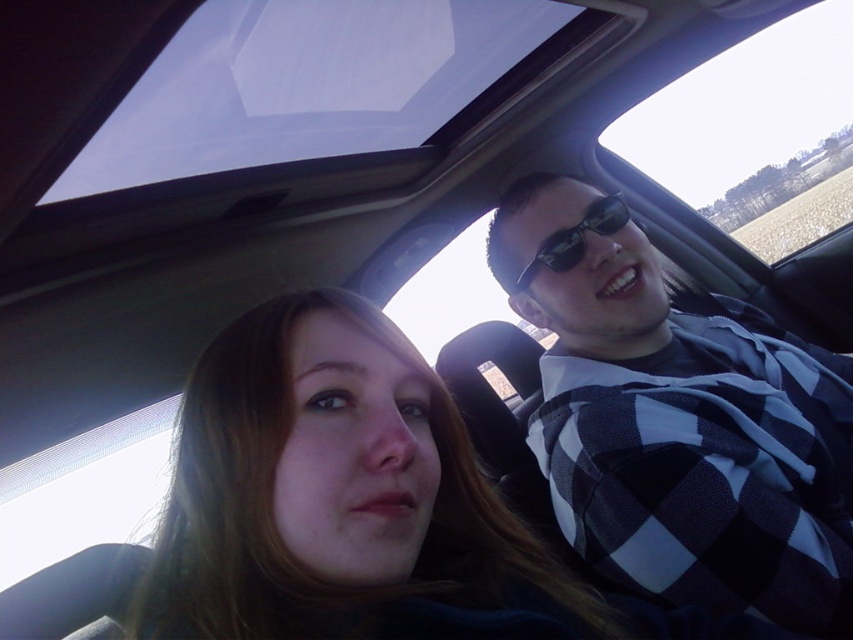
Which is in front, point (544, 317) or point (265, 412)?

Positioned in front is point (265, 412).

Between black checkered shirt at right and smooth brown hair at center, which one has less height?

smooth brown hair at center is shorter.

Is point (840, 380) less distant than point (467, 572)?

No, it is not.

Identify the location of black checkered shirt at right. (677, 419).

Can you confirm if black checkered shirt at right is positioned above black plastic sunglasses at upper right?

Actually, black checkered shirt at right is below black plastic sunglasses at upper right.

Which is behind, point (640, 419) or point (566, 269)?

The point (566, 269) is more distant.

Find the location of a particular element. black checkered shirt at right is located at coordinates (677, 419).

Does smooth brown hair at center have a lesser height compared to black plastic sunglasses at upper right?

No, smooth brown hair at center is not shorter than black plastic sunglasses at upper right.

Who is taller, smooth brown hair at center or black plastic sunglasses at upper right?

Standing taller between the two is smooth brown hair at center.

What do you see at coordinates (277, 515) in the screenshot?
I see `smooth brown hair at center` at bounding box center [277, 515].

Find the location of `smooth brown hair at center`. smooth brown hair at center is located at coordinates (277, 515).